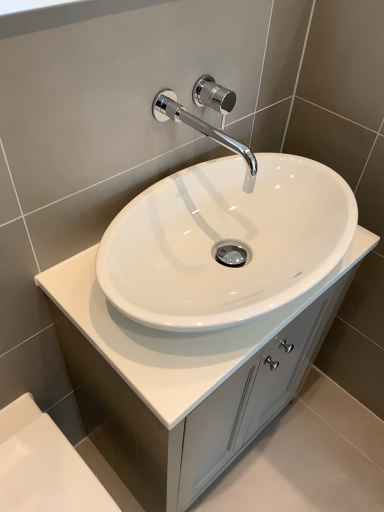
Image resolution: width=384 pixels, height=512 pixels. What do you see at coordinates (204, 131) in the screenshot? I see `chrome/polished metal faucet at upper center` at bounding box center [204, 131].

Find the location of `polished chrome faucet at upper center`. polished chrome faucet at upper center is located at coordinates (213, 96).

You are a GUI agent. You are given a task and a screenshot of the screen. Output one action in this format:
    pyautogui.click(x=<x>, y=<y>)
    Task: Click on the white glossy cabinet at center
    Image resolution: width=384 pixels, height=512 pixels.
    Given the screenshot: What is the action you would take?
    pyautogui.click(x=183, y=378)

Which is more to the left, white glossy cabinet at center or polished chrome faucet at upper center?

polished chrome faucet at upper center is more to the left.

Who is smaller, white glossy cabinet at center or polished chrome faucet at upper center?

polished chrome faucet at upper center.

Is point (246, 331) farther from viewer compared to point (211, 90)?

No, it is in front of (211, 90).

Can you confirm if polished chrome faucet at upper center is wider than chrome/polished metal faucet at upper center?

Incorrect, the width of polished chrome faucet at upper center does not surpass that of chrome/polished metal faucet at upper center.

Would you consider polished chrome faucet at upper center to be distant from chrome/polished metal faucet at upper center?

No, polished chrome faucet at upper center is in close proximity to chrome/polished metal faucet at upper center.

How different are the orientations of polished chrome faucet at upper center and chrome/polished metal faucet at upper center in degrees?

They differ by 0.00461 degrees in their facing directions.

Where is `tap below the polished chrome faucet at upper center (from the image's perspective)`? The width and height of the screenshot is (384, 512). tap below the polished chrome faucet at upper center (from the image's perspective) is located at coordinates (204, 131).

Is polished chrome faucet at upper center thinner than white glossy cabinet at center?

Yes.

Is polished chrome faucet at upper center completely or partially outside of white glossy cabinet at center?

That's correct, polished chrome faucet at upper center is outside of white glossy cabinet at center.

From a real-world perspective, between polished chrome faucet at upper center and white glossy cabinet at center, who is vertically lower?

In real-world perspective, white glossy cabinet at center is lower.

Is point (216, 94) closer or farther from the camera than point (99, 406)?

Point (216, 94) is closer to the camera than point (99, 406).

Can you confirm if polished chrome faucet at upper center is wider than white glossy bath at lower left?

In fact, polished chrome faucet at upper center might be narrower than white glossy bath at lower left.

Looking at this image, from the image's perspective, who appears lower, polished chrome faucet at upper center or white glossy bath at lower left?

white glossy bath at lower left.

Is white glossy bath at lower left inside polished chrome faucet at upper center?

Actually, white glossy bath at lower left is outside polished chrome faucet at upper center.

Which point is more distant from viewer, (212, 88) or (86, 502)?

The point (212, 88) is farther from the camera.

From the image's perspective, would you say white glossy bath at lower left is shown under chrome/polished metal faucet at upper center?

Yes.

Is white glossy bath at lower left to the left or to the right of chrome/polished metal faucet at upper center in the image?

Clearly, white glossy bath at lower left is on the left of chrome/polished metal faucet at upper center in the image.

Between white glossy bath at lower left and chrome/polished metal faucet at upper center, which one has more height?

With more height is white glossy bath at lower left.

Is white glossy bath at lower left outside of chrome/polished metal faucet at upper center?

Yes, white glossy bath at lower left is outside of chrome/polished metal faucet at upper center.

Is white glossy bath at lower left aimed at white glossy cabinet at center?

No, white glossy bath at lower left is not oriented towards white glossy cabinet at center.

Is white glossy bath at lower left bigger or smaller than white glossy cabinet at center?

Considering their sizes, white glossy bath at lower left takes up less space than white glossy cabinet at center.

From the picture: Which is correct: white glossy bath at lower left is inside white glossy cabinet at center, or outside of it?

white glossy bath at lower left is spatially situated outside white glossy cabinet at center.

Is the position of white glossy bath at lower left more distant than that of white glossy cabinet at center?

That is True.

Is white glossy bath at lower left a part of white glossy cabinet at center?

Actually, white glossy bath at lower left is outside white glossy cabinet at center.

From a real-world perspective, does white glossy cabinet at center sit lower than white glossy bath at lower left?

Actually, white glossy cabinet at center is physically above white glossy bath at lower left in the real world.

Considering the sizes of objects white glossy cabinet at center and white glossy bath at lower left in the image provided, who is shorter, white glossy cabinet at center or white glossy bath at lower left?

white glossy bath at lower left.

Does white glossy cabinet at center turn towards white glossy bath at lower left?

No, white glossy cabinet at center is not aimed at white glossy bath at lower left.

This screenshot has height=512, width=384. Find the location of `bathroom cabinet in front of the polished chrome faucet at upper center`. bathroom cabinet in front of the polished chrome faucet at upper center is located at coordinates [x=183, y=378].

What are the coordinates of `shower on the right of chrome/polished metal faucet at upper center` in the screenshot? It's located at (213, 96).

Which object lies nearer to the anchor point white glossy cabinet at center, chrome/polished metal faucet at upper center or polished chrome faucet at upper center?

chrome/polished metal faucet at upper center is closer to white glossy cabinet at center.

Looking at this image, looking at the image, which one is located closer to chrome/polished metal faucet at upper center, white glossy bath at lower left or white glossy cabinet at center?

white glossy cabinet at center.

Estimate the real-world distances between objects in this image. Which object is closer to white glossy bath at lower left, white glossy cabinet at center or chrome/polished metal faucet at upper center?

white glossy cabinet at center is closer to white glossy bath at lower left.

Considering their positions, is chrome/polished metal faucet at upper center positioned further to white glossy bath at lower left than white glossy cabinet at center?

chrome/polished metal faucet at upper center lies further to white glossy bath at lower left than the other object.

Looking at this image, considering their positions, is polished chrome faucet at upper center positioned closer to white glossy bath at lower left than chrome/polished metal faucet at upper center?

chrome/polished metal faucet at upper center is closer to white glossy bath at lower left.

Considering their positions, is polished chrome faucet at upper center positioned closer to white glossy cabinet at center than white glossy bath at lower left?

white glossy bath at lower left lies closer to white glossy cabinet at center than the other object.

From the image, which object appears to be farther from white glossy cabinet at center, polished chrome faucet at upper center or chrome/polished metal faucet at upper center?

The object further to white glossy cabinet at center is polished chrome faucet at upper center.

From the image, which object appears to be farther from polished chrome faucet at upper center, white glossy bath at lower left or white glossy cabinet at center?

The object further to polished chrome faucet at upper center is white glossy bath at lower left.

Identify the location of bathroom cabinet between chrome/polished metal faucet at upper center and white glossy bath at lower left from top to bottom. (183, 378).

The height and width of the screenshot is (512, 384). I want to click on bathroom cabinet between polished chrome faucet at upper center and white glossy bath at lower left in the vertical direction, so click(x=183, y=378).

Where is `tap between polished chrome faucet at upper center and white glossy cabinet at center vertically`? The image size is (384, 512). tap between polished chrome faucet at upper center and white glossy cabinet at center vertically is located at coordinates (204, 131).

Image resolution: width=384 pixels, height=512 pixels. In order to click on tap between polished chrome faucet at upper center and white glossy bath at lower left from top to bottom in this screenshot , I will do `click(204, 131)`.